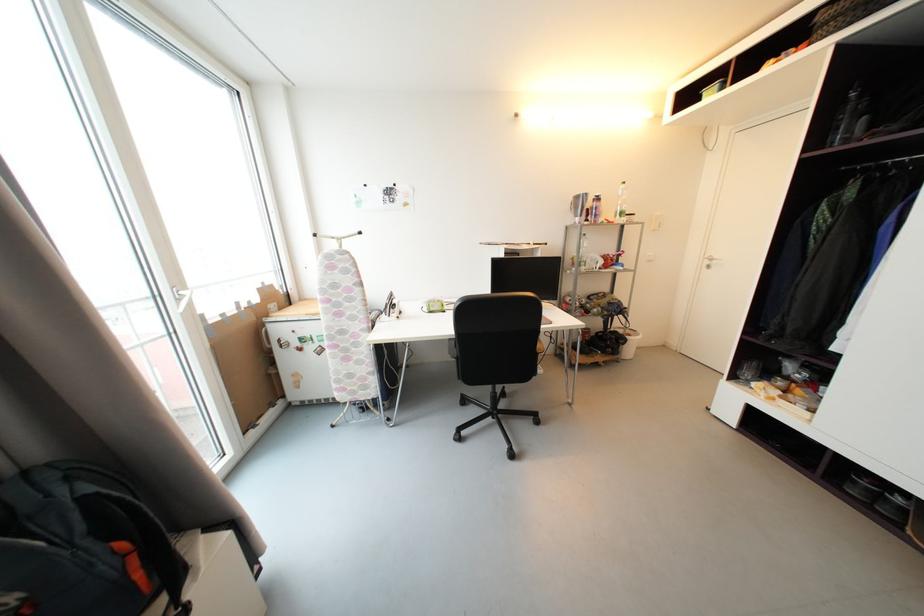
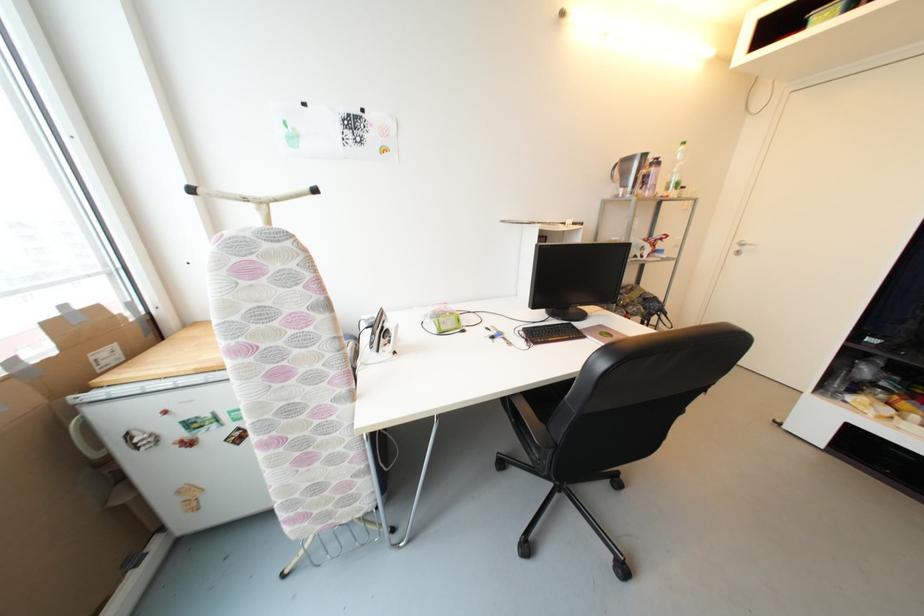
Locate, in the second image, the point that corresponds to the point at 321,237 in the first image.

(197, 192)